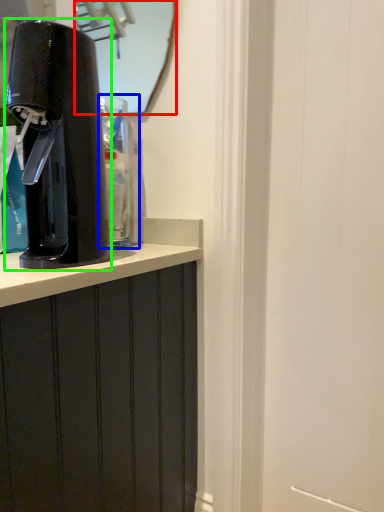
Question: Which object is the farthest from mirror (highlighted by a red box)? Choose among these: water cooler (highlighted by a blue box) or home appliance (highlighted by a green box).

Choices:
 (A) water cooler
 (B) home appliance

Answer: (B)